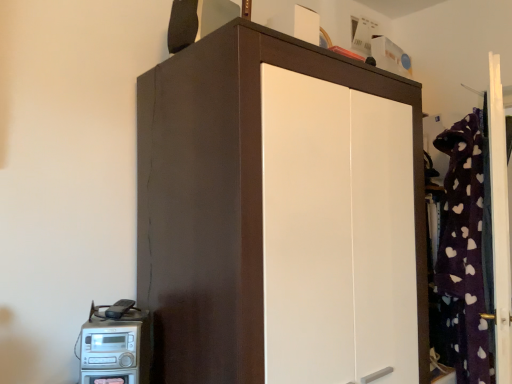
Question: Should I look upward or downward to see satin silver radio at lower left?

Choices:
 (A) up
 (B) down

Answer: (B)

Question: Considering the relative positions of matte brown cupboard at center and satin silver radio at lower left in the image provided, is matte brown cupboard at center to the right of satin silver radio at lower left from the viewer's perspective?

Choices:
 (A) no
 (B) yes

Answer: (B)

Question: From the image's perspective, would you say matte brown cupboard at center is positioned over satin silver radio at lower left?

Choices:
 (A) no
 (B) yes

Answer: (B)

Question: Considering the relative positions of matte brown cupboard at center and satin silver radio at lower left in the image provided, is matte brown cupboard at center in front of satin silver radio at lower left?

Choices:
 (A) no
 (B) yes

Answer: (B)

Question: From the image's perspective, is matte brown cupboard at center beneath satin silver radio at lower left?

Choices:
 (A) yes
 (B) no

Answer: (B)

Question: From a real-world perspective, does matte brown cupboard at center stand above satin silver radio at lower left?

Choices:
 (A) no
 (B) yes

Answer: (B)

Question: Is matte brown cupboard at center wider than satin silver radio at lower left?

Choices:
 (A) yes
 (B) no

Answer: (A)

Question: Does satin silver radio at lower left come in front of matte brown cupboard at center?

Choices:
 (A) yes
 (B) no

Answer: (B)

Question: From a real-world perspective, is satin silver radio at lower left over matte brown cupboard at center?

Choices:
 (A) no
 (B) yes

Answer: (A)

Question: Can you confirm if satin silver radio at lower left is bigger than matte brown cupboard at center?

Choices:
 (A) no
 (B) yes

Answer: (A)

Question: Does satin silver radio at lower left lie behind matte brown cupboard at center?

Choices:
 (A) no
 (B) yes

Answer: (B)

Question: Is satin silver radio at lower left not near matte brown cupboard at center?

Choices:
 (A) yes
 (B) no

Answer: (B)

Question: Are satin silver radio at lower left and matte brown cupboard at center beside each other?

Choices:
 (A) yes
 (B) no

Answer: (B)

Question: Relative to satin silver radio at lower left, is matte brown cupboard at center in front or behind?

Choices:
 (A) behind
 (B) front

Answer: (B)